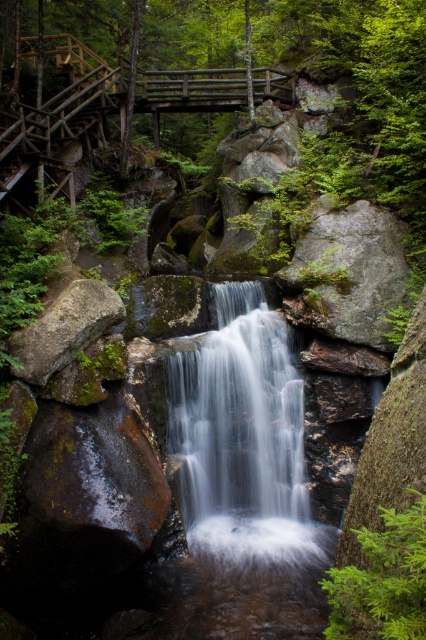
Question: Can you confirm if smooth gray water at center is smaller than brown rough rock at lower left?

Choices:
 (A) no
 (B) yes

Answer: (A)

Question: Is smooth gray water at center smaller than brown rough rock at lower left?

Choices:
 (A) yes
 (B) no

Answer: (B)

Question: Does smooth gray water at center come in front of brown rough rock at lower left?

Choices:
 (A) yes
 (B) no

Answer: (B)